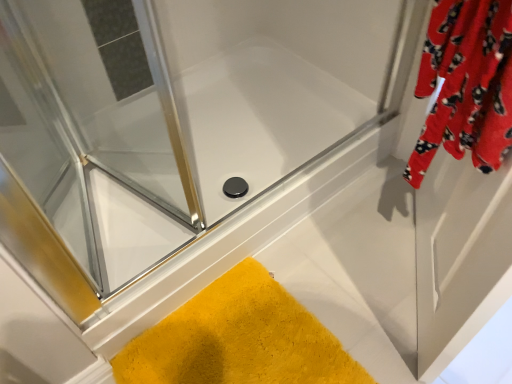
Describe the element at coordinates (95, 130) in the screenshot. I see `transparent glass shower door at upper left, the first screen door positioned from the left` at that location.

How much space does transparent glass shower door at upper left, which is the 2th screen door from right to left, occupy vertically?

transparent glass shower door at upper left, which is the 2th screen door from right to left, is 25.85 inches tall.

Identify the location of velvet red robe at upper right, positioned as the 2th screen door in left-to-right order. (459, 256).

Which is behind, point (75, 244) or point (217, 302)?

The point (217, 302) is farther from the camera.

Looking at the image, does transparent glass shower door at upper left, which is the 2th screen door from right to left, seem bigger or smaller compared to yellow fuzzy bath mat at lower left?

transparent glass shower door at upper left, which is the 2th screen door from right to left, is bigger than yellow fuzzy bath mat at lower left.

Can you tell me how much transparent glass shower door at upper left, which is the 2th screen door from right to left, and yellow fuzzy bath mat at lower left differ in facing direction?

The angle between the facing direction of transparent glass shower door at upper left, which is the 2th screen door from right to left, and the facing direction of yellow fuzzy bath mat at lower left is 68.8 degrees.

Considering the relative positions of transparent glass shower door at upper left, which is the 2th screen door from right to left, and yellow fuzzy bath mat at lower left in the image provided, is transparent glass shower door at upper left, which is the 2th screen door from right to left, to the left or to the right of yellow fuzzy bath mat at lower left?

From the image, it's evident that transparent glass shower door at upper left, which is the 2th screen door from right to left, is to the left of yellow fuzzy bath mat at lower left.

I want to click on the 2nd screen door located above the yellow fuzzy bath mat at lower left (from a real-world perspective), so click(95, 130).

Is yellow fuzzy bath mat at lower left not near transparent glass shower door at upper left, which is the 2th screen door from right to left?

No, there isn't a large distance between yellow fuzzy bath mat at lower left and transparent glass shower door at upper left, which is the 2th screen door from right to left.

Consider the image. Is yellow fuzzy bath mat at lower left oriented away from transparent glass shower door at upper left, the first screen door positioned from the left?

No, yellow fuzzy bath mat at lower left's orientation is not away from transparent glass shower door at upper left, the first screen door positioned from the left.

Does point (257, 363) come farther from viewer compared to point (185, 164)?

Yes.

Between yellow fuzzy bath mat at lower left and velvet red robe at upper right, positioned as the 2th screen door in left-to-right order, which one appears on the right side from the viewer's perspective?

velvet red robe at upper right, positioned as the 2th screen door in left-to-right order, is more to the right.

Is point (196, 328) farther from camera compared to point (406, 112)?

No, (196, 328) is closer to viewer.

Between yellow fuzzy bath mat at lower left and velvet red robe at upper right, which appears as the 1th screen door when viewed from the right, which one has less height?

With less height is yellow fuzzy bath mat at lower left.

Is velvet red robe at upper right, positioned as the 2th screen door in left-to-right order, at the back of yellow fuzzy bath mat at lower left?

No, yellow fuzzy bath mat at lower left is not facing the opposite direction of velvet red robe at upper right, positioned as the 2th screen door in left-to-right order.

Which object is positioned more to the right, velvet red robe at upper right, positioned as the 2th screen door in left-to-right order, or transparent glass shower door at upper left, which is the 2th screen door from right to left?

Positioned to the right is velvet red robe at upper right, positioned as the 2th screen door in left-to-right order.

Considering the sizes of objects velvet red robe at upper right, positioned as the 2th screen door in left-to-right order, and transparent glass shower door at upper left, which is the 2th screen door from right to left, in the image provided, who is bigger, velvet red robe at upper right, positioned as the 2th screen door in left-to-right order, or transparent glass shower door at upper left, which is the 2th screen door from right to left,?

With larger size is velvet red robe at upper right, positioned as the 2th screen door in left-to-right order.

Between point (481, 311) and point (137, 35), which one is positioned in front?

The point (481, 311) is closer to the camera.

From the image's perspective, is velvet red robe at upper right, positioned as the 2th screen door in left-to-right order, above or below yellow fuzzy bath mat at lower left?

velvet red robe at upper right, positioned as the 2th screen door in left-to-right order, is above yellow fuzzy bath mat at lower left.

From the picture: Who is taller, velvet red robe at upper right, which appears as the 1th screen door when viewed from the right, or yellow fuzzy bath mat at lower left?

With more height is velvet red robe at upper right, which appears as the 1th screen door when viewed from the right.

Looking at the image, does velvet red robe at upper right, which appears as the 1th screen door when viewed from the right, seem bigger or smaller compared to yellow fuzzy bath mat at lower left?

velvet red robe at upper right, which appears as the 1th screen door when viewed from the right, is bigger than yellow fuzzy bath mat at lower left.

Based on their positions, is velvet red robe at upper right, which appears as the 1th screen door when viewed from the right, located to the left or right of yellow fuzzy bath mat at lower left?

Clearly, velvet red robe at upper right, which appears as the 1th screen door when viewed from the right, is on the right of yellow fuzzy bath mat at lower left in the image.

Considering the positions of objects transparent glass shower door at upper left, the first screen door positioned from the left, and velvet red robe at upper right, positioned as the 2th screen door in left-to-right order, in the image provided, who is in front, transparent glass shower door at upper left, the first screen door positioned from the left, or velvet red robe at upper right, positioned as the 2th screen door in left-to-right order,?

velvet red robe at upper right, positioned as the 2th screen door in left-to-right order, is closer to the camera.

Which of these two, transparent glass shower door at upper left, which is the 2th screen door from right to left, or velvet red robe at upper right, which appears as the 1th screen door when viewed from the right, is thinner?

velvet red robe at upper right, which appears as the 1th screen door when viewed from the right, is thinner.

From a real-world perspective, is transparent glass shower door at upper left, which is the 2th screen door from right to left, physically located above or below velvet red robe at upper right, which appears as the 1th screen door when viewed from the right?

transparent glass shower door at upper left, which is the 2th screen door from right to left, is situated higher than velvet red robe at upper right, which appears as the 1th screen door when viewed from the right, in the real world.

Is transparent glass shower door at upper left, which is the 2th screen door from right to left, bigger than velvet red robe at upper right, positioned as the 2th screen door in left-to-right order?

Incorrect, transparent glass shower door at upper left, which is the 2th screen door from right to left, is not larger than velvet red robe at upper right, positioned as the 2th screen door in left-to-right order.

Find the location of a particular element. The image size is (512, 384). bath mat located behind the transparent glass shower door at upper left, which is the 2th screen door from right to left is located at coordinates (238, 339).

The image size is (512, 384). Identify the location of the 2nd screen door located above the yellow fuzzy bath mat at lower left (from a real-world perspective). (95, 130).

When comparing their distances from yellow fuzzy bath mat at lower left, does velvet red robe at upper right, positioned as the 2th screen door in left-to-right order, or transparent glass shower door at upper left, the first screen door positioned from the left, seem further?

The object further to yellow fuzzy bath mat at lower left is transparent glass shower door at upper left, the first screen door positioned from the left.

From the image, which object appears to be farther from velvet red robe at upper right, positioned as the 2th screen door in left-to-right order, transparent glass shower door at upper left, the first screen door positioned from the left, or yellow fuzzy bath mat at lower left?

Among the two, transparent glass shower door at upper left, the first screen door positioned from the left, is located further to velvet red robe at upper right, positioned as the 2th screen door in left-to-right order.

Which object lies further to the anchor point transparent glass shower door at upper left, which is the 2th screen door from right to left, yellow fuzzy bath mat at lower left or velvet red robe at upper right, which appears as the 1th screen door when viewed from the right?

Based on the image, velvet red robe at upper right, which appears as the 1th screen door when viewed from the right, appears to be further to transparent glass shower door at upper left, which is the 2th screen door from right to left.

Based on the photo, looking at the image, which one is located closer to transparent glass shower door at upper left, the first screen door positioned from the left, velvet red robe at upper right, positioned as the 2th screen door in left-to-right order, or yellow fuzzy bath mat at lower left?

yellow fuzzy bath mat at lower left is positioned closer to the anchor transparent glass shower door at upper left, the first screen door positioned from the left.

From the image, which object appears to be farther from velvet red robe at upper right, which appears as the 1th screen door when viewed from the right, yellow fuzzy bath mat at lower left or transparent glass shower door at upper left, the first screen door positioned from the left?

transparent glass shower door at upper left, the first screen door positioned from the left, is positioned further to the anchor velvet red robe at upper right, which appears as the 1th screen door when viewed from the right.

From the image, which object appears to be farther from yellow fuzzy bath mat at lower left, transparent glass shower door at upper left, the first screen door positioned from the left, or velvet red robe at upper right, positioned as the 2th screen door in left-to-right order?

transparent glass shower door at upper left, the first screen door positioned from the left, lies further to yellow fuzzy bath mat at lower left than the other object.

This screenshot has width=512, height=384. In order to click on bath mat located between transparent glass shower door at upper left, the first screen door positioned from the left, and velvet red robe at upper right, which appears as the 1th screen door when viewed from the right, in the left-right direction in this screenshot , I will do `click(238, 339)`.